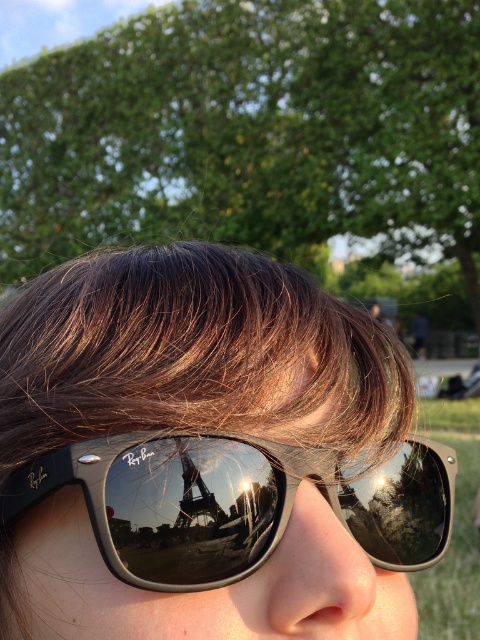
You are a photographer adjusting your camera to focus on two points in the scene. The first point is at coordinates point (160, 497) and the second point is at point (119, 544). Which point is closer to you?

Point (160, 497) is closer to you because it is further to the viewer than point (119, 544).

You are a photographer trying to capture the reflection of the Eiffel Tower in the sunglasses. Given the positioning of the black reflective sunglasses at center and glossy metallic eiffel tower at center, can you confirm if the sunglasses are wide enough to fully frame the Eiffel Tower in their reflection?

The black reflective sunglasses at center might be wider than glossy metallic eiffel tower at center, so there is a possibility that the sunglasses are wide enough to fully frame the Eiffel Tower in their reflection.

What are the coordinates of the black matte sunglasses at center in the image?

The black matte sunglasses at center is located at point [207,456].